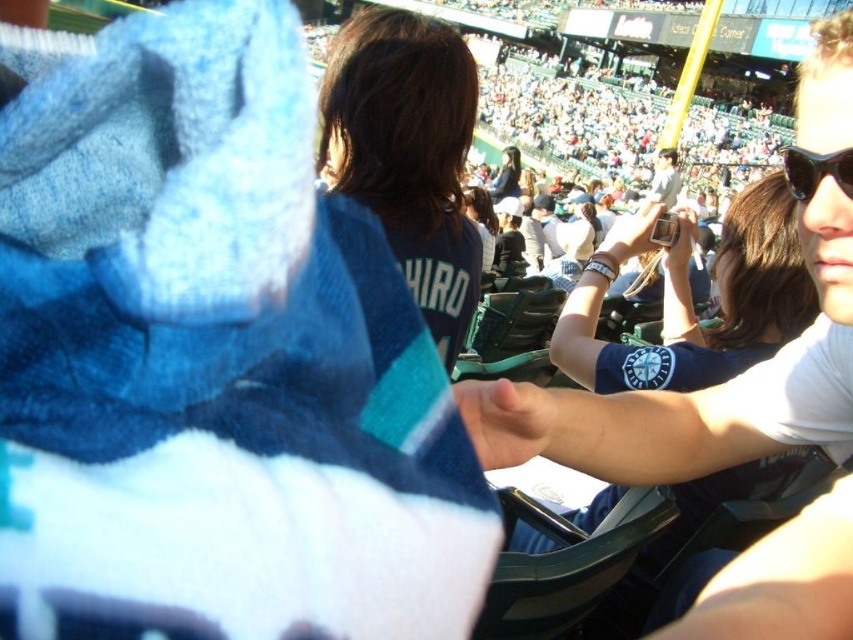
Question: Which object is the farthest from the dark blue jersey at center?

Choices:
 (A) light gray shirt at upper center
 (B) white matte shirt at upper right

Answer: (A)

Question: Estimate the real-world distances between objects in this image. Which object is farther from the matte black jacket at upper center?

Choices:
 (A) matte black jacket at center
 (B) dark blue jersey at center
 (C) black plastic sunglasses at upper right
 (D) light gray shirt at upper center

Answer: (B)

Question: Considering the relative positions of blue fabric wristband at center and matte black jacket at center in the image provided, where is blue fabric wristband at center located with respect to matte black jacket at center?

Choices:
 (A) above
 (B) below

Answer: (B)

Question: Which of the following is the closest to the observer?

Choices:
 (A) white matte shirt at upper right
 (B) black plastic sunglasses at upper right
 (C) blue fabric wristband at center
 (D) light gray shirt at upper center

Answer: (A)

Question: Does blue fabric wristband at center have a lesser width compared to matte black jacket at center?

Choices:
 (A) no
 (B) yes

Answer: (A)

Question: In this image, where is dark blue jersey at center located relative to matte black jacket at center?

Choices:
 (A) below
 (B) above

Answer: (B)